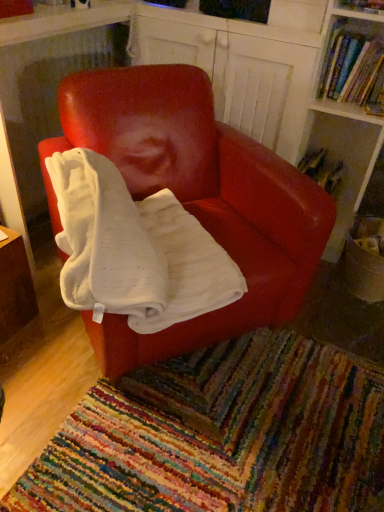
Question: From the image's perspective, does multicolored woven mat at lower center appear lower than matte red chair at center?

Choices:
 (A) yes
 (B) no

Answer: (A)

Question: Is matte red chair at center at the back of multicolored woven mat at lower center?

Choices:
 (A) no
 (B) yes

Answer: (A)

Question: Is multicolored woven mat at lower center not within matte red chair at center?

Choices:
 (A) yes
 (B) no

Answer: (A)

Question: Does multicolored woven mat at lower center have a smaller size compared to matte red chair at center?

Choices:
 (A) yes
 (B) no

Answer: (A)

Question: Is multicolored woven mat at lower center at the left side of matte red chair at center?

Choices:
 (A) no
 (B) yes

Answer: (A)

Question: Does point (372, 54) appear closer or farther from the camera than point (264, 282)?

Choices:
 (A) farther
 (B) closer

Answer: (A)

Question: Considering the positions of hardcover book at upper right, which is counted as the second book, starting from the bottom, and matte red chair at center in the image, is hardcover book at upper right, which is counted as the second book, starting from the bottom, bigger or smaller than matte red chair at center?

Choices:
 (A) small
 (B) big

Answer: (A)

Question: Is hardcover book at upper right, acting as the 1th book starting from the top, situated inside matte red chair at center or outside?

Choices:
 (A) outside
 (B) inside

Answer: (A)

Question: Considering the positions of hardcover book at upper right, acting as the second book starting from the back, and matte red chair at center in the image, is hardcover book at upper right, acting as the second book starting from the back, wider or thinner than matte red chair at center?

Choices:
 (A) wide
 (B) thin

Answer: (B)

Question: From a real-world perspective, is matte red chair at center physically located above or below multicolored woven mat at lower center?

Choices:
 (A) below
 (B) above

Answer: (B)

Question: Based on their sizes in the image, would you say matte red chair at center is bigger or smaller than multicolored woven mat at lower center?

Choices:
 (A) big
 (B) small

Answer: (A)

Question: Considering the positions of matte red chair at center and multicolored woven mat at lower center in the image, is matte red chair at center wider or thinner than multicolored woven mat at lower center?

Choices:
 (A) wide
 (B) thin

Answer: (B)

Question: Considering the positions of point (193, 146) and point (226, 410), is point (193, 146) closer or farther from the camera than point (226, 410)?

Choices:
 (A) farther
 (B) closer

Answer: (A)

Question: Is point (349, 45) positioned closer to the camera than point (180, 430)?

Choices:
 (A) closer
 (B) farther

Answer: (B)

Question: In terms of height, does hardcover book at upper right, acting as the 1th book starting from the top, look taller or shorter compared to multicolored woven mat at lower center?

Choices:
 (A) short
 (B) tall

Answer: (B)